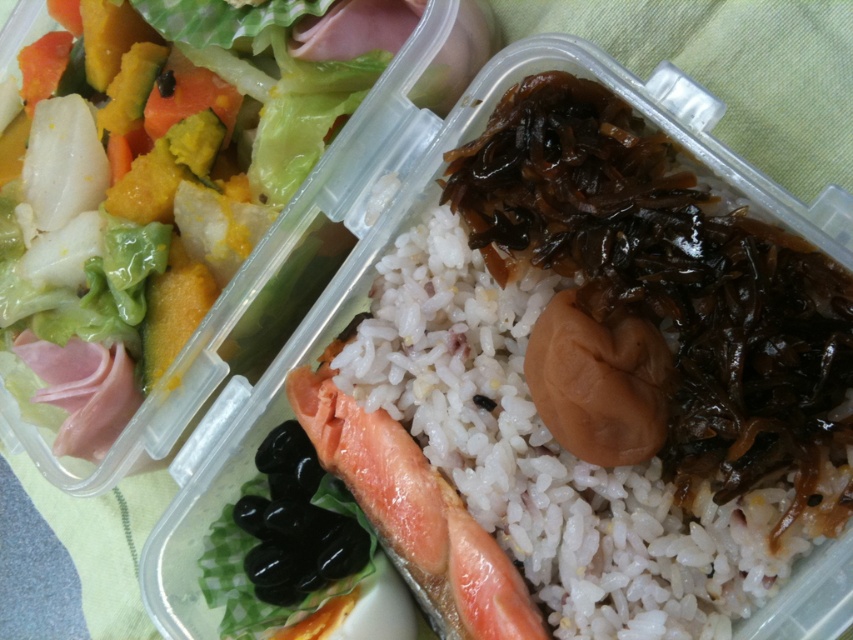
Does white polished rice at center have a greater height compared to shiny green lettuce at upper left?

No, white polished rice at center is not taller than shiny green lettuce at upper left.

The height and width of the screenshot is (640, 853). In order to click on white polished rice at center in this screenshot , I will do `click(550, 456)`.

Is point (392, 346) more distant than point (465, 44)?

No, it is not.

The image size is (853, 640). In order to click on white polished rice at center in this screenshot , I will do `click(550, 456)`.